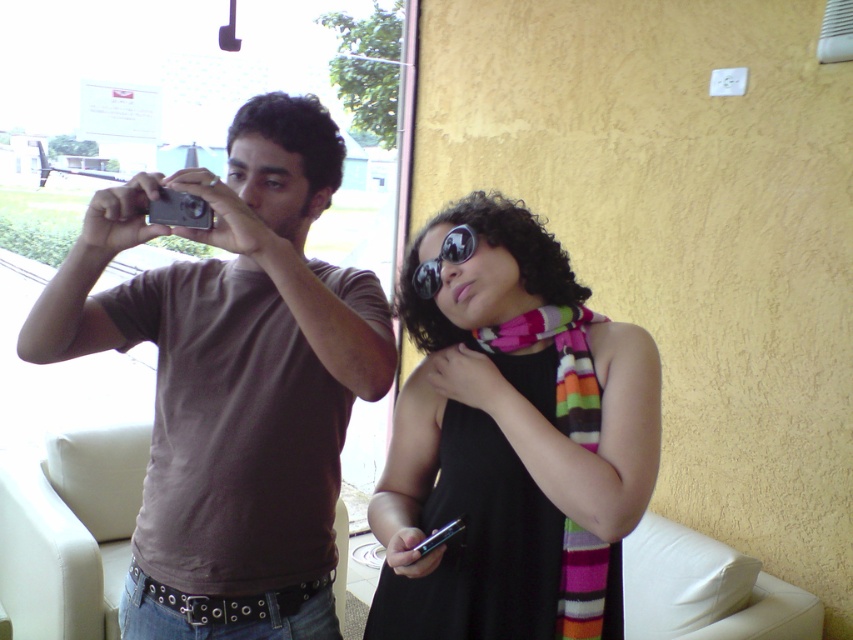
Question: Which object is farther from the camera taking this photo?

Choices:
 (A) brown matte t-shirt at center
 (B) silver metallic camera at upper left
 (C) striped scarf at center

Answer: (B)

Question: Among these objects, which one is nearest to the camera?

Choices:
 (A) brown matte t-shirt at center
 (B) silver metallic camera at upper left
 (C) black reflective sunglasses at center
 (D) striped scarf at center

Answer: (D)

Question: Is striped scarf at center above silver metallic camera at upper left?

Choices:
 (A) no
 (B) yes

Answer: (A)

Question: Which of these objects is positioned closest to the brown matte t-shirt at center?

Choices:
 (A) silver metallic camera at upper left
 (B) striped scarf at center
 (C) black reflective sunglasses at center

Answer: (B)

Question: Can you confirm if brown matte t-shirt at center is wider than striped scarf at center?

Choices:
 (A) no
 (B) yes

Answer: (B)

Question: Can you confirm if brown matte t-shirt at center is positioned above striped scarf at center?

Choices:
 (A) yes
 (B) no

Answer: (A)